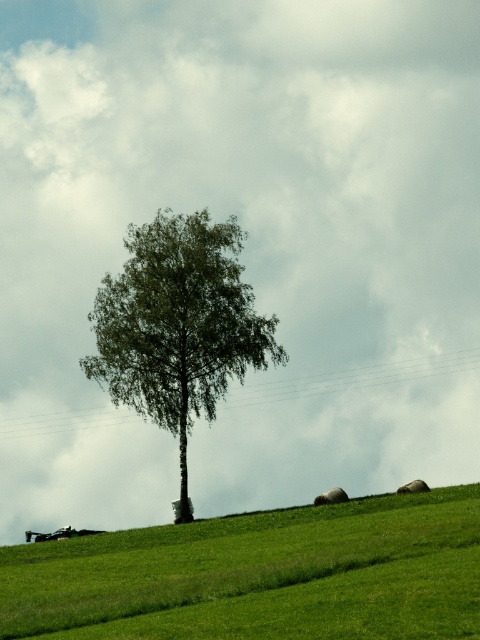
You are standing at the base of the tree on the grassy hill. You want to walk directly towards the point marked by point (260, 576). Is this point located on the slope of the hill or at the bottom of the hill?

The point (260, 576) is located on the green grassy hillside at lower center, which is part of the slope of the hill. Therefore, walking towards this point would mean moving along the slope of the hill.